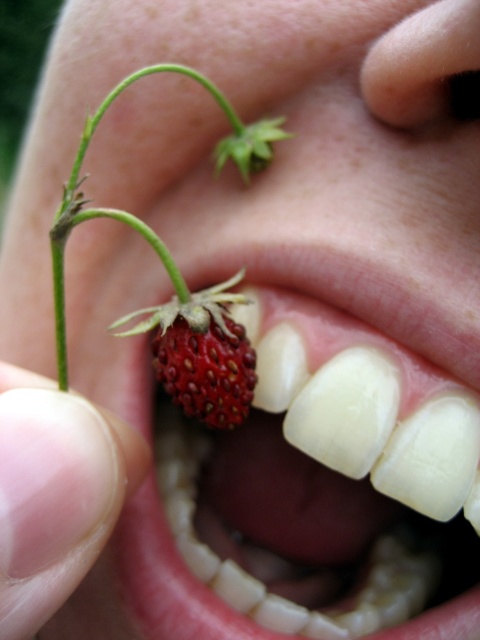
You are a dentist examining a patient. You notice the smooth skin at mouth and the ripe red strawberry at mouth. Which object is positioned to the right?

The ripe red strawberry at mouth is positioned to the right of the smooth skin at mouth.